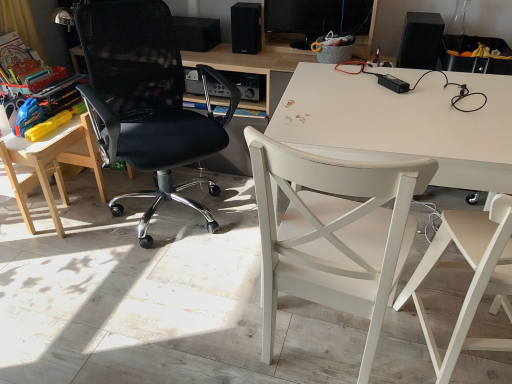
What do you see at coordinates (246, 28) in the screenshot? I see `black matte speaker at upper center, positioned as the second loudspeaker in left-to-right order` at bounding box center [246, 28].

Where is `black mesh office chair at left, the second chair from the left`? black mesh office chair at left, the second chair from the left is located at coordinates (147, 100).

Describe the element at coordinates (317, 18) in the screenshot. Image resolution: width=512 pixels, height=384 pixels. I see `black glossy computer monitor at upper center` at that location.

This screenshot has height=384, width=512. What do you see at coordinates (420, 41) in the screenshot? I see `black matte speaker at upper right, which is the first loudspeaker from right to left` at bounding box center [420, 41].

What do you see at coordinates (60, 151) in the screenshot?
I see `wooden table at left` at bounding box center [60, 151].

Where is `white wood chair at right, which appears as the first chair when viewed from the right`? This screenshot has width=512, height=384. white wood chair at right, which appears as the first chair when viewed from the right is located at coordinates (473, 276).

From the image's perspective, relative to black matte speaker at upper center, acting as the second loudspeaker starting from the right, is wooden table at left above or below?

wooden table at left is below black matte speaker at upper center, acting as the second loudspeaker starting from the right.

In the image, is wooden table at left on the left side or the right side of black matte speaker at upper center, positioned as the second loudspeaker in left-to-right order?

wooden table at left is to the left of black matte speaker at upper center, positioned as the second loudspeaker in left-to-right order.

Is wooden table at left wider than black matte speaker at upper center, positioned as the second loudspeaker in left-to-right order?

Indeed, wooden table at left has a greater width compared to black matte speaker at upper center, positioned as the second loudspeaker in left-to-right order.

Which point is more distant from viewer, (52, 159) or (245, 16)?

Positioned behind is point (245, 16).

Who is bigger, black matte speaker at upper right, which is the first loudspeaker from right to left, or light wood/wooden chair at left, placed as the first chair when sorted from left to right?

With larger size is light wood/wooden chair at left, placed as the first chair when sorted from left to right.

Considering the positions of objects black matte speaker at upper right, the 3th loudspeaker when ordered from left to right, and light wood/wooden chair at left, the 4th chair from the right, in the image provided, who is more to the left, black matte speaker at upper right, the 3th loudspeaker when ordered from left to right, or light wood/wooden chair at left, the 4th chair from the right,?

light wood/wooden chair at left, the 4th chair from the right.

Does point (428, 36) come farther from viewer compared to point (63, 194)?

No.

Which of these two, black matte speaker at upper right, the 3th loudspeaker when ordered from left to right, or light wood/wooden chair at left, placed as the first chair when sorted from left to right, stands taller?

Standing taller between the two is light wood/wooden chair at left, placed as the first chair when sorted from left to right.

Is the depth of black matte speaker at upper center, which appears as the 3th loudspeaker when viewed from the right, greater than that of white wood chair at right, which appears as the first chair when viewed from the right?

Yes, black matte speaker at upper center, which appears as the 3th loudspeaker when viewed from the right, is behind white wood chair at right, which appears as the first chair when viewed from the right.

Measure the distance between black matte speaker at upper center, which appears as the 3th loudspeaker when viewed from the right, and white wood chair at right, which appears as the first chair when viewed from the right.

black matte speaker at upper center, which appears as the 3th loudspeaker when viewed from the right, is 1.77 meters from white wood chair at right, which appears as the first chair when viewed from the right.

Are black matte speaker at upper center, which appears as the 3th loudspeaker when viewed from the right, and white wood chair at right, placed as the 4th chair when sorted from left to right, far apart?

Yes, black matte speaker at upper center, which appears as the 3th loudspeaker when viewed from the right, and white wood chair at right, placed as the 4th chair when sorted from left to right, are located far from each other.

Can you tell me how much black matte speaker at upper center, which appears as the 3th loudspeaker when viewed from the right, and white wood chair at right, which appears as the first chair when viewed from the right, differ in facing direction?

The facing directions of black matte speaker at upper center, which appears as the 3th loudspeaker when viewed from the right, and white wood chair at right, which appears as the first chair when viewed from the right, are 168 degrees apart.

Considering the positions of objects black glossy computer monitor at upper center and black mesh office chair at left, the second chair from the left, in the image provided, who is more to the left, black glossy computer monitor at upper center or black mesh office chair at left, the second chair from the left,?

From the viewer's perspective, black mesh office chair at left, the second chair from the left, appears more on the left side.

Can you confirm if black glossy computer monitor at upper center is smaller than black mesh office chair at left, positioned as the 3th chair in right-to-left order?

Yes.

Looking at this image, can we say black glossy computer monitor at upper center lies outside black mesh office chair at left, the second chair from the left?

Yes, black glossy computer monitor at upper center is not within black mesh office chair at left, the second chair from the left.

Identify the location of computer monitor behind the black mesh office chair at left, positioned as the 3th chair in right-to-left order. (317, 18).

Measure the distance from black mesh office chair at left, the second chair from the left, to wooden table at left.

black mesh office chair at left, the second chair from the left, is 36.22 centimeters from wooden table at left.

Would you say black mesh office chair at left, positioned as the 3th chair in right-to-left order, contains wooden table at left?

No, wooden table at left is not surrounded by black mesh office chair at left, positioned as the 3th chair in right-to-left order.

Based on their positions, is black mesh office chair at left, the second chair from the left, located to the left or right of wooden table at left?

From the image, it's evident that black mesh office chair at left, the second chair from the left, is to the right of wooden table at left.

Is black mesh office chair at left, positioned as the 3th chair in right-to-left order, beside wooden table at left?

No, black mesh office chair at left, positioned as the 3th chair in right-to-left order, is not next to wooden table at left.

Considering the points (290, 21) and (367, 176), which point is in front, point (290, 21) or point (367, 176)?

The point (367, 176) is more forward.

Is black glossy computer monitor at upper center positioned beyond the bounds of white wood chair at center, the second chair positioned from the right?

Yes, black glossy computer monitor at upper center is outside of white wood chair at center, the second chair positioned from the right.

From a real-world perspective, which object rests below the other?

white wood chair at center, the 3th chair viewed from the left, from a real-world perspective.

Is black glossy computer monitor at upper center far away from white wood chair at center, the second chair positioned from the right?

That's right, there is a large distance between black glossy computer monitor at upper center and white wood chair at center, the second chair positioned from the right.

From a real-world perspective, which object rests below the other?

white wood chair at right, which appears as the first chair when viewed from the right, from a real-world perspective.

Consider the image. Considering the relative sizes of white wood chair at center, the second chair positioned from the right, and white wood chair at right, which appears as the first chair when viewed from the right, in the image provided, is white wood chair at center, the second chair positioned from the right, smaller than white wood chair at right, which appears as the first chair when viewed from the right,?

Actually, white wood chair at center, the second chair positioned from the right, might be larger than white wood chair at right, which appears as the first chair when viewed from the right.

Is white wood chair at center, the second chair positioned from the right, turned away from white wood chair at right, placed as the 4th chair when sorted from left to right?

white wood chair at center, the second chair positioned from the right, is not turned away from white wood chair at right, placed as the 4th chair when sorted from left to right.

Which of these two, white wood chair at center, the second chair positioned from the right, or white wood chair at right, placed as the 4th chair when sorted from left to right, stands taller?

white wood chair at center, the second chair positioned from the right, is taller.

Identify the location of table below the black matte speaker at upper center, acting as the second loudspeaker starting from the right (from a real-world perspective). (60, 151).

Image resolution: width=512 pixels, height=384 pixels. Find the location of `loudspeaker that is the 1st object located above the light wood/wooden chair at left, placed as the first chair when sorted from left to right (from the image's perspective)`. loudspeaker that is the 1st object located above the light wood/wooden chair at left, placed as the first chair when sorted from left to right (from the image's perspective) is located at coordinates (420, 41).

Considering their positions, is black matte speaker at upper right, which is the first loudspeaker from right to left, positioned closer to black glossy computer monitor at upper center than black mesh office chair at left, the second chair from the left?

black matte speaker at upper right, which is the first loudspeaker from right to left.

When comparing their distances from black matte speaker at upper center, arranged as the first loudspeaker when viewed from the left, does white wood chair at right, placed as the 4th chair when sorted from left to right, or black matte speaker at upper center, positioned as the second loudspeaker in left-to-right order, seem closer?

black matte speaker at upper center, positioned as the second loudspeaker in left-to-right order, is positioned closer to the anchor black matte speaker at upper center, arranged as the first loudspeaker when viewed from the left.

Looking at the image, which one is located further to black matte speaker at upper right, which is the first loudspeaker from right to left, black matte speaker at upper center, which appears as the 3th loudspeaker when viewed from the right, or light wood/wooden chair at left, the 4th chair from the right?

light wood/wooden chair at left, the 4th chair from the right.

Based on their spatial positions, is wooden table at left or black matte speaker at upper center, arranged as the first loudspeaker when viewed from the left, closer to light wood/wooden chair at left, placed as the first chair when sorted from left to right?

wooden table at left.

Estimate the real-world distances between objects in this image. Which object is closer to white wood chair at right, which appears as the first chair when viewed from the right, black matte speaker at upper center, arranged as the first loudspeaker when viewed from the left, or black matte speaker at upper right, which is the first loudspeaker from right to left?

black matte speaker at upper right, which is the first loudspeaker from right to left, is positioned closer to the anchor white wood chair at right, which appears as the first chair when viewed from the right.

Which object lies nearer to the anchor point black glossy computer monitor at upper center, black matte speaker at upper right, the 3th loudspeaker when ordered from left to right, or white wood chair at center, the 3th chair viewed from the left?

black matte speaker at upper right, the 3th loudspeaker when ordered from left to right.

From the image, which object appears to be farther from black glossy computer monitor at upper center, black matte speaker at upper center, acting as the second loudspeaker starting from the right, or black matte speaker at upper center, which appears as the 3th loudspeaker when viewed from the right?

The object further to black glossy computer monitor at upper center is black matte speaker at upper center, which appears as the 3th loudspeaker when viewed from the right.

When comparing their distances from black mesh office chair at left, the second chair from the left, does black matte speaker at upper center, which appears as the 3th loudspeaker when viewed from the right, or black matte speaker at upper center, acting as the second loudspeaker starting from the right, seem closer?

Among the two, black matte speaker at upper center, which appears as the 3th loudspeaker when viewed from the right, is located nearer to black mesh office chair at left, the second chair from the left.

This screenshot has width=512, height=384. Find the location of `computer monitor between black mesh office chair at left, the second chair from the left, and black matte speaker at upper center, acting as the second loudspeaker starting from the right, from front to back`. computer monitor between black mesh office chair at left, the second chair from the left, and black matte speaker at upper center, acting as the second loudspeaker starting from the right, from front to back is located at coordinates (317, 18).

Find the location of a particular element. Image resolution: width=512 pixels, height=384 pixels. computer monitor between wooden table at left and black matte speaker at upper right, which is the first loudspeaker from right to left, in the horizontal direction is located at coordinates (317, 18).

At what (x,y) coordinates should I click in order to perform the action: click on computer monitor between white wood chair at center, the 3th chair viewed from the left, and black matte speaker at upper center, which appears as the 3th loudspeaker when viewed from the right, in the front-back direction. Please return your answer as a coordinate pair (x, y). Looking at the image, I should click on (317, 18).

The image size is (512, 384). What are the coordinates of `computer monitor between wooden table at left and white wood chair at right, placed as the 4th chair when sorted from left to right` in the screenshot? It's located at (317, 18).